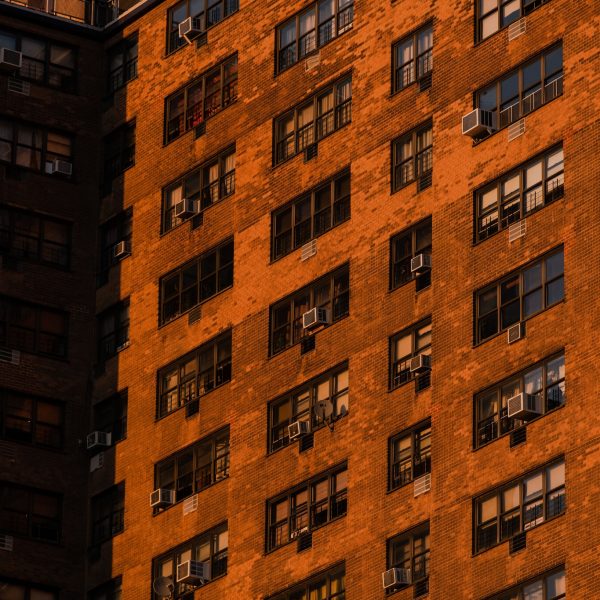
At what (x,y) coordinates should I click in order to perform the action: click on air conditioners. Please return your answer as a coordinate pair (x, y). Looking at the image, I should click on (391, 578), (511, 406), (185, 571), (157, 498), (296, 431), (308, 313), (418, 261), (473, 121), (181, 208).